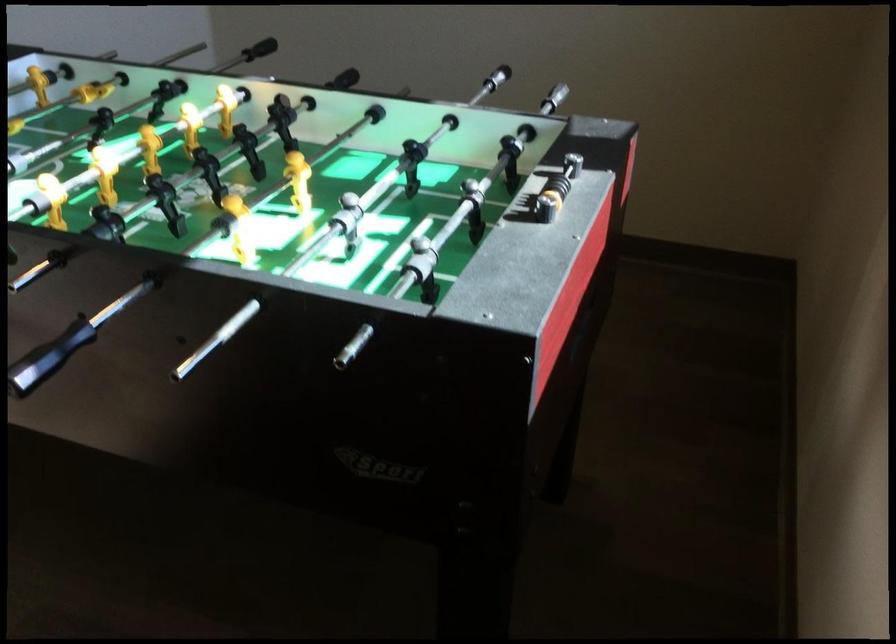
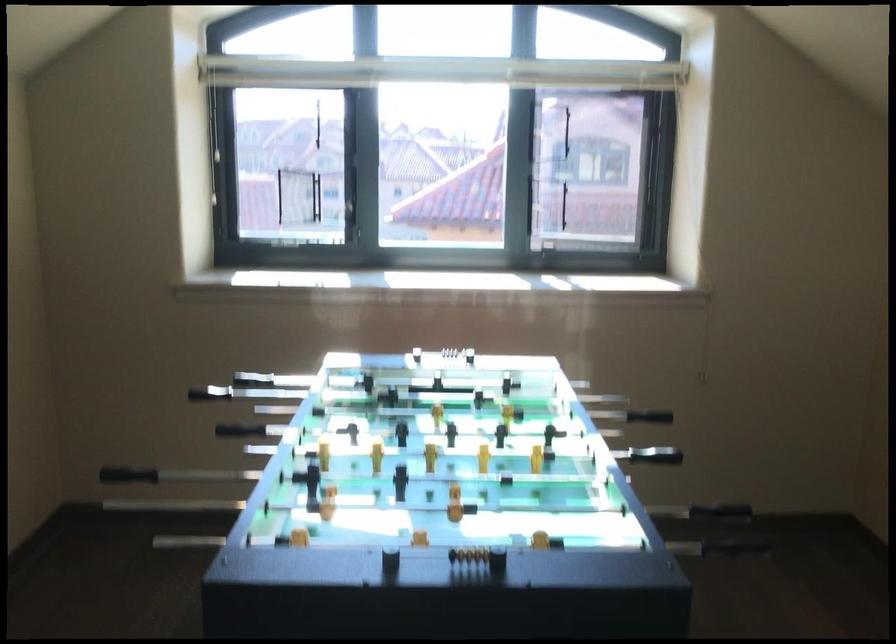
The point at [556,185] is marked in the first image. Where is the corresponding point in the second image?

(440, 354)